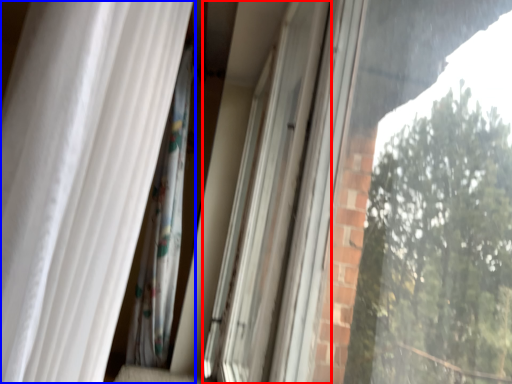
Question: Among these objects, which one is nearest to the camera, screen door (highlighted by a red box) or curtain (highlighted by a blue box)?

Choices:
 (A) screen door
 (B) curtain

Answer: (B)